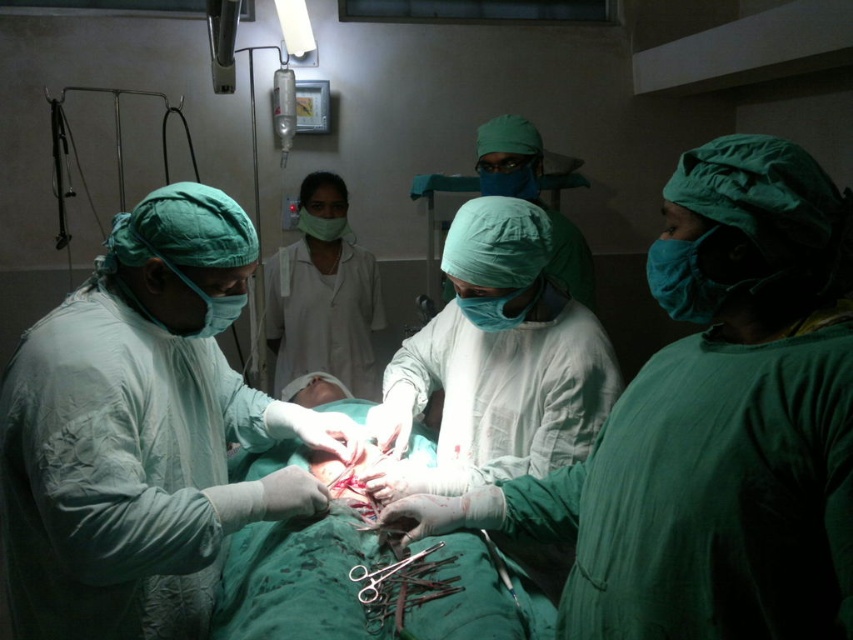
Question: Does green matte surgical gown at center lie in front of matte green surgical cap at center?

Choices:
 (A) no
 (B) yes

Answer: (B)

Question: Is surgical scissors at center above matte green surgical cap at center?

Choices:
 (A) no
 (B) yes

Answer: (A)

Question: Which of the following is the farthest from the observer?

Choices:
 (A) (289, 502)
 (B) (432, 257)
 (C) (431, 582)

Answer: (B)

Question: Estimate the real-world distances between objects in this image. Which object is closer to the matte green gown at center?

Choices:
 (A) surgical scissors at center
 (B) matte green surgical cap at center

Answer: (A)

Question: Is matte green gown at center positioned behind surgical scissors at center?

Choices:
 (A) no
 (B) yes

Answer: (A)

Question: Estimate the real-world distances between objects in this image. Which object is closer to the surgical scissors at center?

Choices:
 (A) matte green surgical cap at center
 (B) green matte surgical gown at center

Answer: (B)